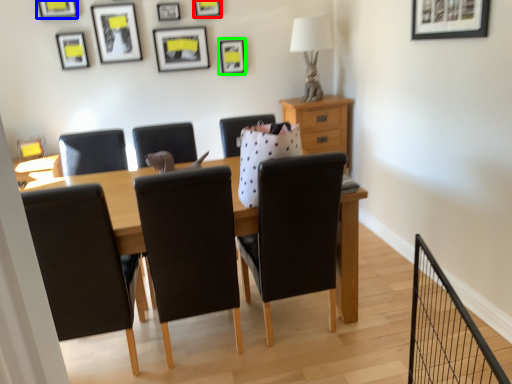
Question: Estimate the real-world distances between objects in this image. Which object is farther from picture frame (highlighted by a red box), picture frame (highlighted by a blue box) or picture frame (highlighted by a green box)?

Choices:
 (A) picture frame
 (B) picture frame

Answer: (A)